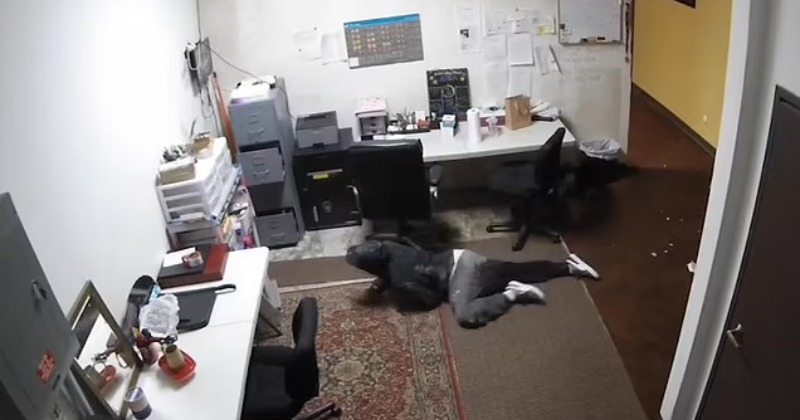
You are a GUI agent. You are given a task and a screenshot of the screen. Output one action in this format:
    pyautogui.click(x=<x>, y=<y>)
    Task: Click on the wooden door
    The image size is (800, 420).
    Given the screenshot: What is the action you would take?
    pyautogui.click(x=762, y=260)